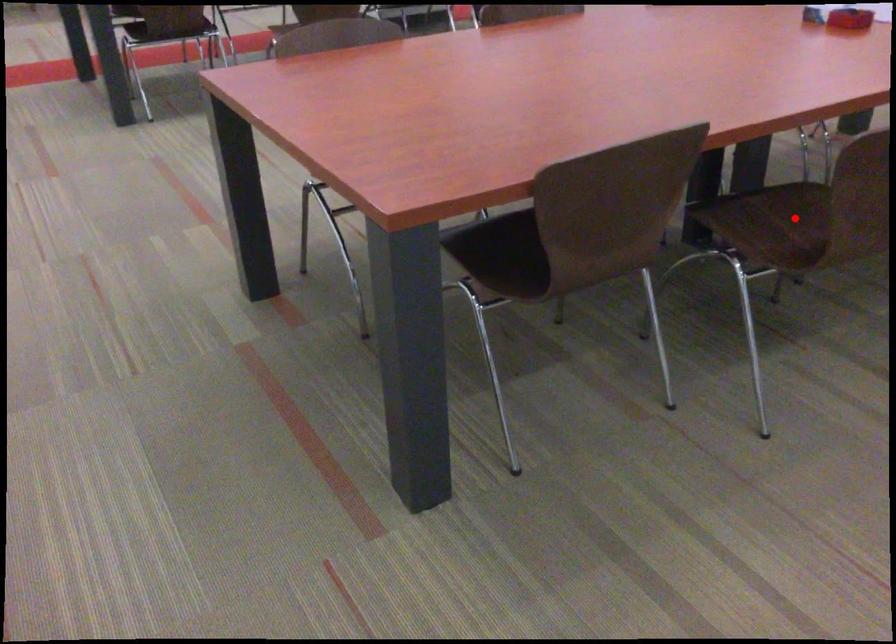
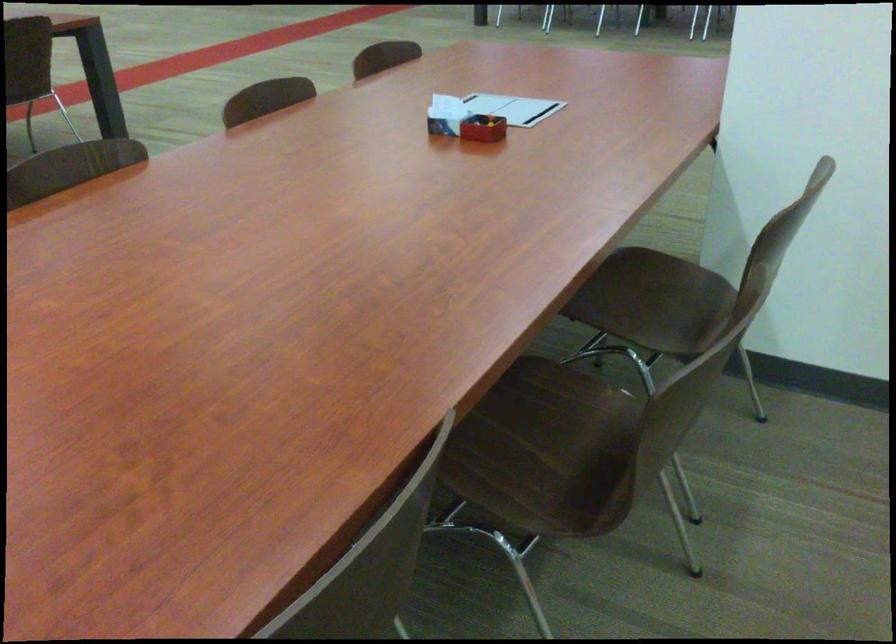
Find the pixel in the second image that matches the highlighted location in the first image.

(541, 428)